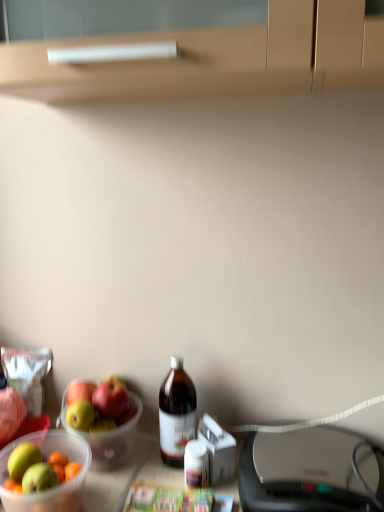
Question: From a real-world perspective, is translucent plastic bowl at lower left physically above brown glass bottle at center?

Choices:
 (A) yes
 (B) no

Answer: (B)

Question: Is translucent plastic bowl at lower left next to brown glass bottle at center?

Choices:
 (A) yes
 (B) no

Answer: (B)

Question: Is translucent plastic bowl at lower left to the right of brown glass bottle at center from the viewer's perspective?

Choices:
 (A) no
 (B) yes

Answer: (A)

Question: Does translucent plastic bowl at lower left have a lesser width compared to brown glass bottle at center?

Choices:
 (A) yes
 (B) no

Answer: (B)

Question: Does translucent plastic bowl at lower left have a larger size compared to brown glass bottle at center?

Choices:
 (A) yes
 (B) no

Answer: (A)

Question: Is translucent plastic bowl at lower left smaller than brown glass bottle at center?

Choices:
 (A) no
 (B) yes

Answer: (A)

Question: Does translucent plastic bowl at lower left have a greater height compared to matte black printer at lower right?

Choices:
 (A) no
 (B) yes

Answer: (B)

Question: Is translucent plastic bowl at lower left smaller than matte black printer at lower right?

Choices:
 (A) yes
 (B) no

Answer: (A)

Question: Is translucent plastic bowl at lower left facing towards matte black printer at lower right?

Choices:
 (A) no
 (B) yes

Answer: (B)

Question: Would you consider translucent plastic bowl at lower left to be distant from matte black printer at lower right?

Choices:
 (A) yes
 (B) no

Answer: (B)

Question: From a real-world perspective, is translucent plastic bowl at lower left physically above matte black printer at lower right?

Choices:
 (A) no
 (B) yes

Answer: (B)

Question: Does translucent plastic bowl at lower left have a lesser height compared to matte black printer at lower right?

Choices:
 (A) yes
 (B) no

Answer: (B)

Question: Is brown glass bottle at center bigger than translucent plastic bowl at lower left?

Choices:
 (A) no
 (B) yes

Answer: (A)